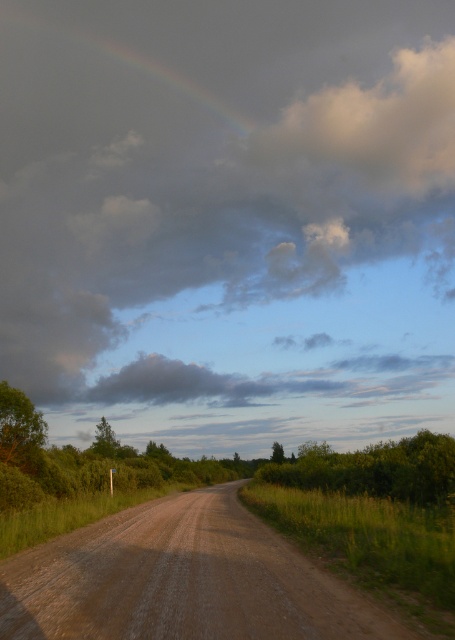
Question: Which of the following is the farthest from the observer?

Choices:
 (A) brown gravel road at center
 (B) rainbow at upper center
 (C) cloudy at upper center

Answer: (B)

Question: Does brown gravel road at center appear under rainbow at upper center?

Choices:
 (A) yes
 (B) no

Answer: (A)

Question: Can you confirm if cloudy at upper center is thinner than brown gravel road at center?

Choices:
 (A) yes
 (B) no

Answer: (B)

Question: Which object is positioned farthest from the cloudy at upper center?

Choices:
 (A) brown gravel road at center
 (B) rainbow at upper center

Answer: (A)

Question: Which point is farther to the camera?

Choices:
 (A) brown gravel road at center
 (B) rainbow at upper center

Answer: (B)

Question: From the image, what is the correct spatial relationship of cloudy at upper center in relation to rainbow at upper center?

Choices:
 (A) below
 (B) above

Answer: (A)